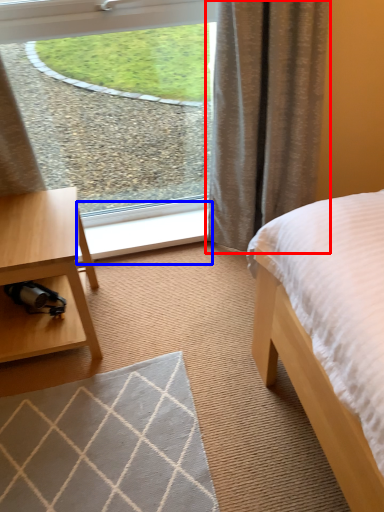
Question: Among these objects, which one is nearest to the camera, curtain (highlighted by a red box) or window sill (highlighted by a blue box)?

Choices:
 (A) curtain
 (B) window sill

Answer: (A)